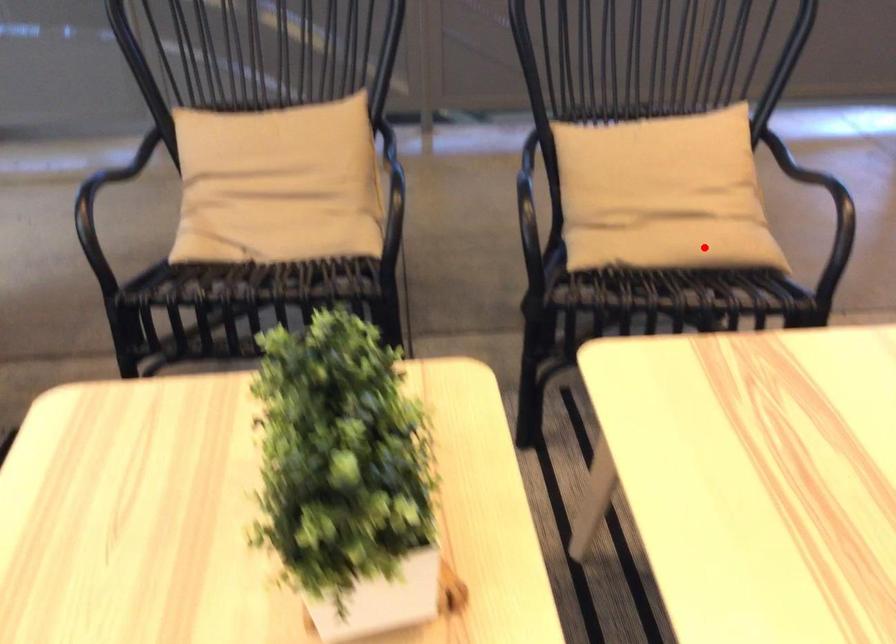
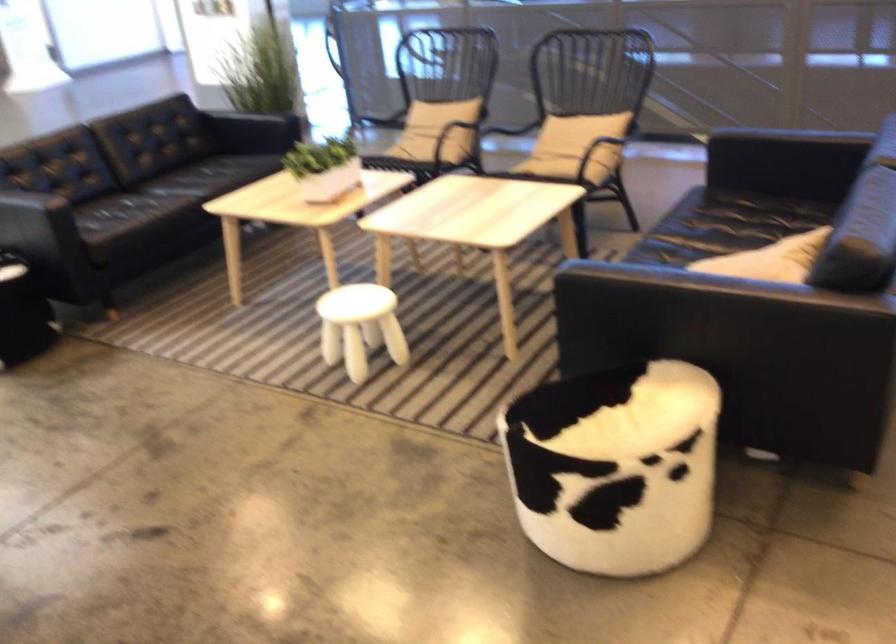
Locate, in the second image, the point that corresponds to the highlighted location in the first image.

(552, 160)